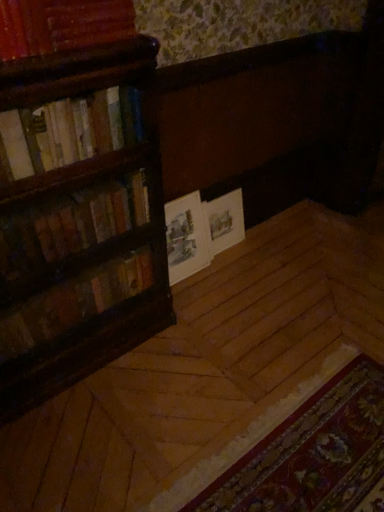
Question: From the image's perspective, is hardcover books at left, arranged as the 2th book when viewed from the top, under wooden book at upper left, which is counted as the fourth book, starting from the bottom?

Choices:
 (A) yes
 (B) no

Answer: (A)

Question: Can you confirm if hardcover books at left, arranged as the third book when ordered from the bottom, is thinner than wooden book at upper left, which is counted as the fourth book, starting from the bottom?

Choices:
 (A) yes
 (B) no

Answer: (A)

Question: Is hardcover books at left, arranged as the third book when ordered from the bottom, facing towards wooden book at upper left, which is counted as the fourth book, starting from the bottom?

Choices:
 (A) yes
 (B) no

Answer: (B)

Question: Is hardcover books at left, arranged as the 2th book when viewed from the top, facing away from wooden book at upper left, which is counted as the fourth book, starting from the bottom?

Choices:
 (A) yes
 (B) no

Answer: (B)

Question: Considering the relative sizes of hardcover books at left, arranged as the 2th book when viewed from the top, and wooden book at upper left, which is counted as the fourth book, starting from the bottom, in the image provided, is hardcover books at left, arranged as the 2th book when viewed from the top, shorter than wooden book at upper left, which is counted as the fourth book, starting from the bottom,?

Choices:
 (A) yes
 (B) no

Answer: (B)

Question: From a real-world perspective, is white paper at center positioned above or below carpeted mat at lower right?

Choices:
 (A) above
 (B) below

Answer: (A)

Question: Considering the positions of point (193, 269) and point (322, 404), is point (193, 269) closer or farther from the camera than point (322, 404)?

Choices:
 (A) closer
 (B) farther

Answer: (B)

Question: Looking at the image, does white paper at center seem bigger or smaller compared to carpeted mat at lower right?

Choices:
 (A) big
 (B) small

Answer: (B)

Question: From the image's perspective, relative to carpeted mat at lower right, is white paper at center above or below?

Choices:
 (A) below
 (B) above

Answer: (B)

Question: Choose the correct answer: Is carpeted mat at lower right inside white paper at center or outside it?

Choices:
 (A) inside
 (B) outside

Answer: (B)

Question: Looking at their shapes, would you say carpeted mat at lower right is wider or thinner than white paper at center?

Choices:
 (A) wide
 (B) thin

Answer: (A)

Question: From the image's perspective, relative to white paper at center, is carpeted mat at lower right above or below?

Choices:
 (A) above
 (B) below

Answer: (B)

Question: In terms of size, does carpeted mat at lower right appear bigger or smaller than white paper at center?

Choices:
 (A) big
 (B) small

Answer: (A)

Question: Is white paper book at center to the left or to the right of wooden bookshelf at left, placed as the 4th book when sorted from top to bottom, in the image?

Choices:
 (A) left
 (B) right

Answer: (B)

Question: From a real-world perspective, relative to wooden bookshelf at left, placed as the first book when sorted from bottom to top, is white paper book at center vertically above or below?

Choices:
 (A) above
 (B) below

Answer: (B)